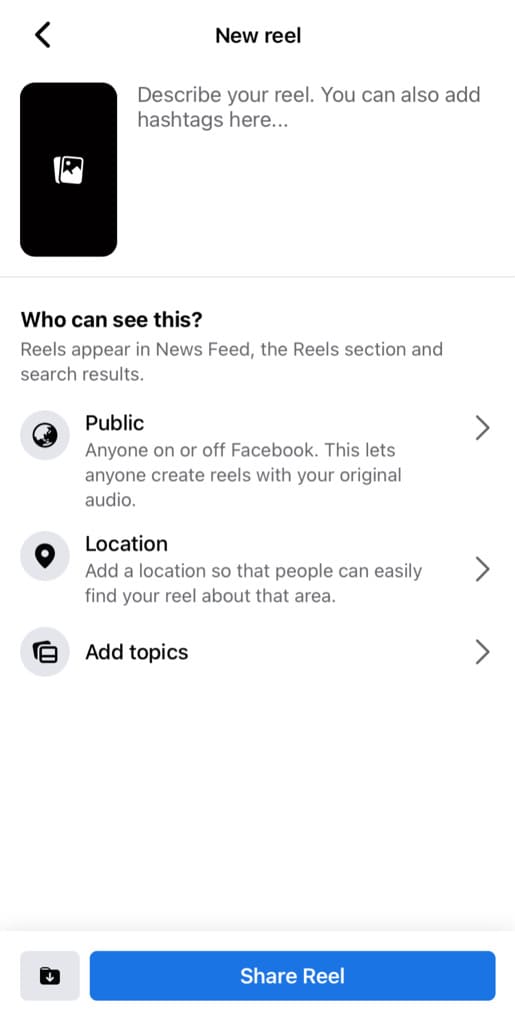
Where is `globe`? This screenshot has height=1023, width=515. globe is located at coordinates (44, 434).